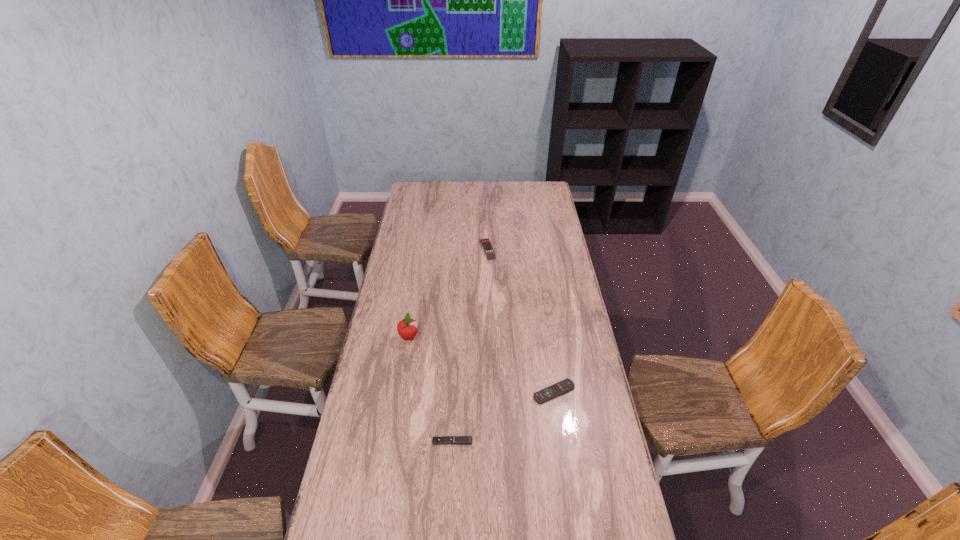
What are the coordinates of `vacant space located 0.290m on the back of the leftmost remote control` in the screenshot? It's located at (456, 367).

Locate an element on the screen. vacant region located 0.290m on the left of the rightmost remote control is located at coordinates (453, 392).

The image size is (960, 540). I want to click on object positioned at the left edge, so click(x=407, y=328).

At what (x,y) coordinates should I click in order to perform the action: click on object at the right edge. Please return your answer as a coordinate pair (x, y). The width and height of the screenshot is (960, 540). Looking at the image, I should click on (566, 385).

Locate an element on the screen. This screenshot has height=540, width=960. vacant space at the far edge is located at coordinates (470, 184).

The image size is (960, 540). I want to click on vacant region at the left edge of the desktop, so click(x=396, y=245).

You are a GUI agent. You are given a task and a screenshot of the screen. Output one action in this format:
    pyautogui.click(x=<x>, y=<y>)
    Task: Click on the free space at the right edge of the desktop
    Image resolution: width=960 pixels, height=540 pixels.
    Given the screenshot: What is the action you would take?
    pyautogui.click(x=538, y=204)

In the image, there is a desktop. Identify the location of vacant space at the far left corner. This screenshot has height=540, width=960. (417, 201).

In the image, there is a desktop. At what (x,y) coordinates should I click in order to perform the action: click on free region at the far right corner. Please return your answer as a coordinate pair (x, y). The height and width of the screenshot is (540, 960). Looking at the image, I should click on (526, 186).

The width and height of the screenshot is (960, 540). Identify the location of vacant area between the second farthest object and the nearest remote control. click(430, 389).